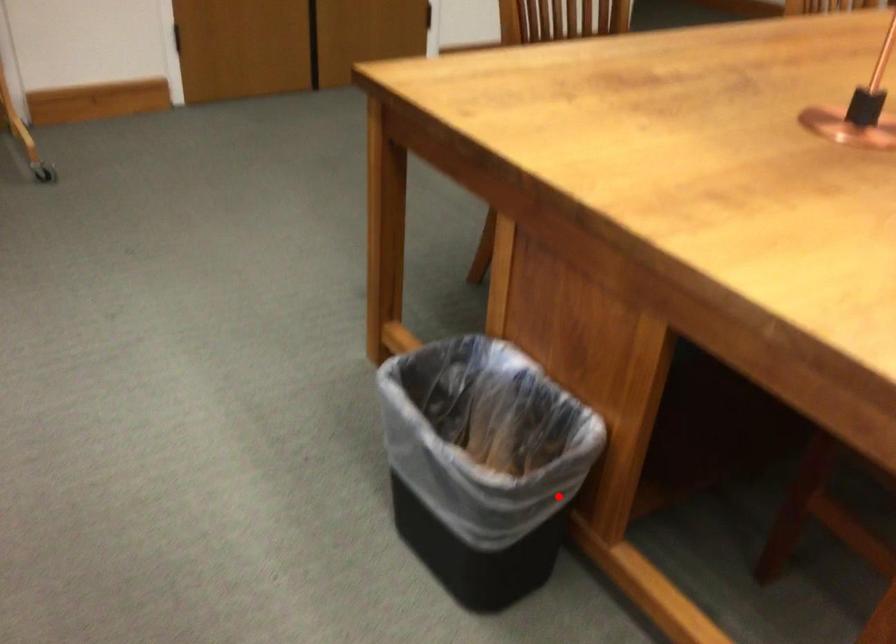
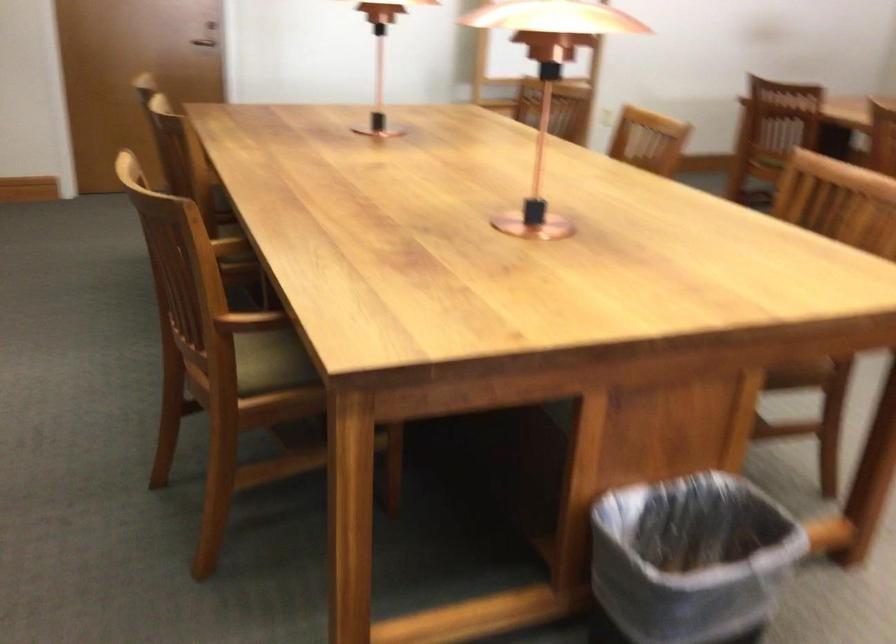
Question: I am providing you with two images of the same scene from different viewpoints. Given a red point in image1, look at the same physical point in image2. Is it:

Choices:
 (A) Closer to the viewpoint
 (B) Farther from the viewpoint

Answer: (B)